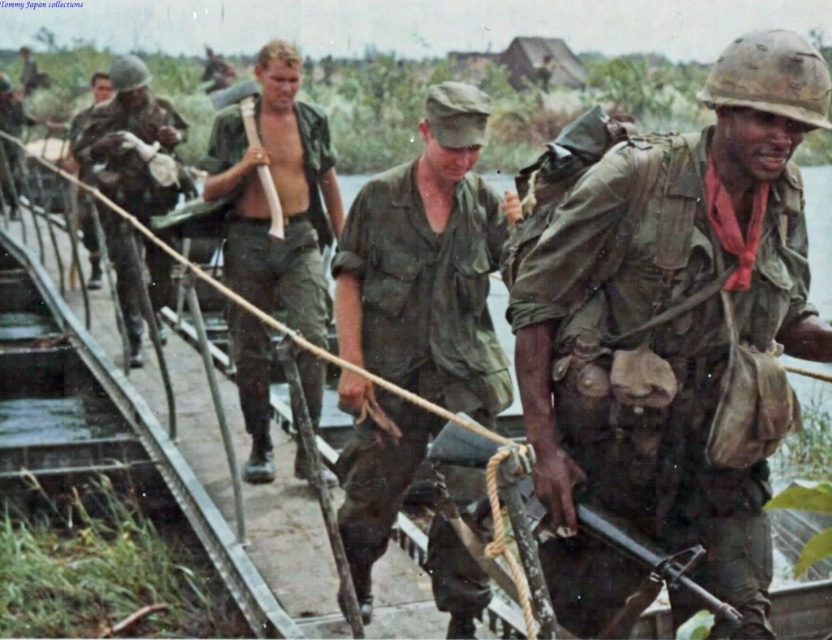
Question: Is green matte uniform at center closer to camera compared to matte green uniform at left?

Choices:
 (A) yes
 (B) no

Answer: (A)

Question: Which object is farther from the camera taking this photo?

Choices:
 (A) camouflage fabric helmet at center
 (B) green matte uniform at center

Answer: (B)

Question: Which object appears farthest from the camera in this image?

Choices:
 (A) matte black rifle at center
 (B) camouflage fabric shirt at center
 (C) camouflage fabric helmet at center

Answer: (B)

Question: Does matte black rifle at center appear on the left side of matte green helmet at left?

Choices:
 (A) yes
 (B) no

Answer: (B)

Question: Among these objects, which one is nearest to the camera?

Choices:
 (A) matte green helmet at left
 (B) camouflage fabric shirt at center
 (C) matte green uniform at left
 (D) matte black rifle at center

Answer: (D)

Question: Does green matte uniform at center have a lesser width compared to camouflage fabric shirt at center?

Choices:
 (A) yes
 (B) no

Answer: (A)